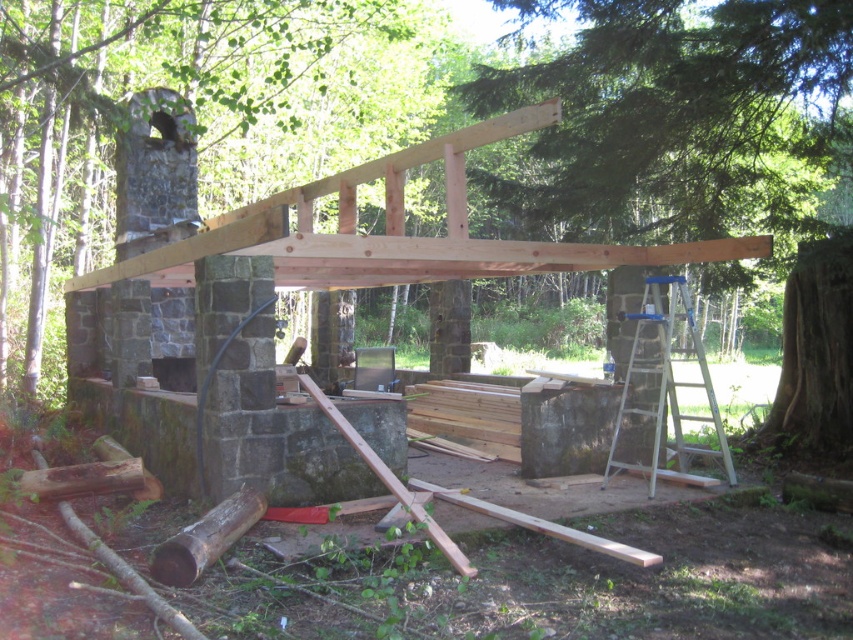
Question: Among these points, which one is farthest from the camera?

Choices:
 (A) (653, 385)
 (B) (648, 180)

Answer: (B)

Question: Is natural wood beam at center wider than metallic silver ladder at right?

Choices:
 (A) no
 (B) yes

Answer: (A)

Question: Which of the following is the farthest from the observer?

Choices:
 (A) (698, 364)
 (B) (662, 67)

Answer: (A)

Question: Is natural wood beam at center further to camera compared to metallic silver ladder at right?

Choices:
 (A) no
 (B) yes

Answer: (B)

Question: Which object is closer to the camera taking this photo?

Choices:
 (A) natural wood beam at center
 (B) metallic silver ladder at right

Answer: (B)

Question: Can you confirm if natural wood beam at center is positioned to the right of metallic silver ladder at right?

Choices:
 (A) yes
 (B) no

Answer: (B)